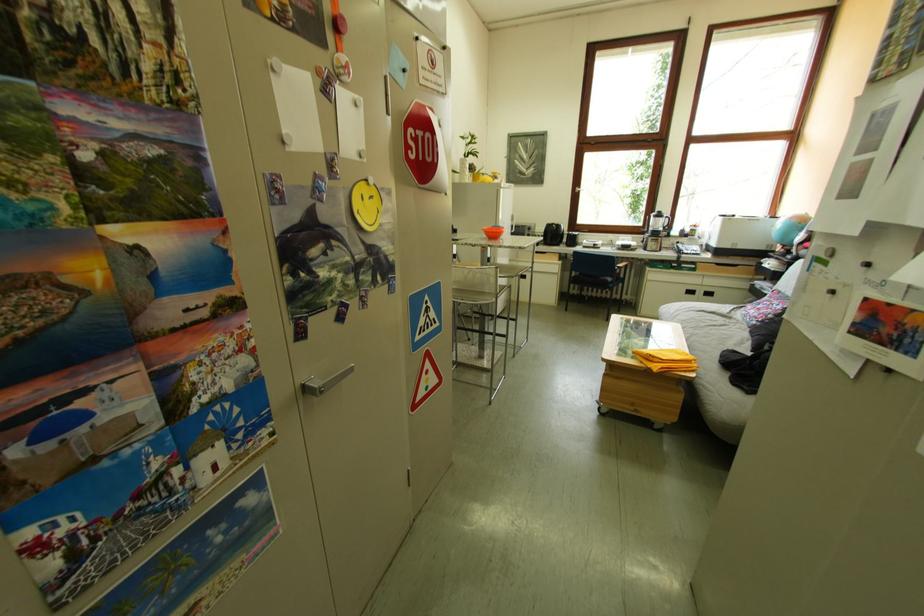
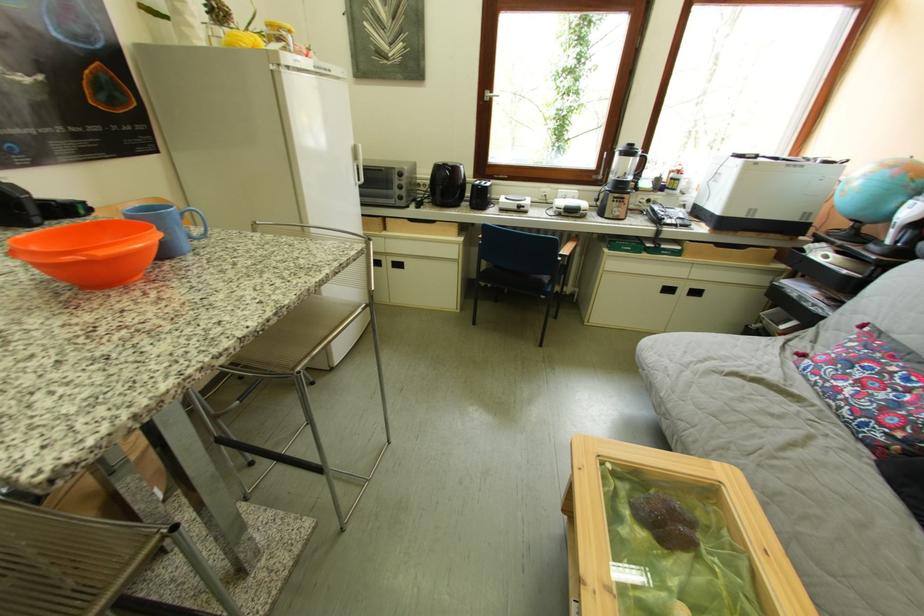
The point at (x=707, y=270) is marked in the first image. Where is the corresponding point in the second image?

(690, 251)